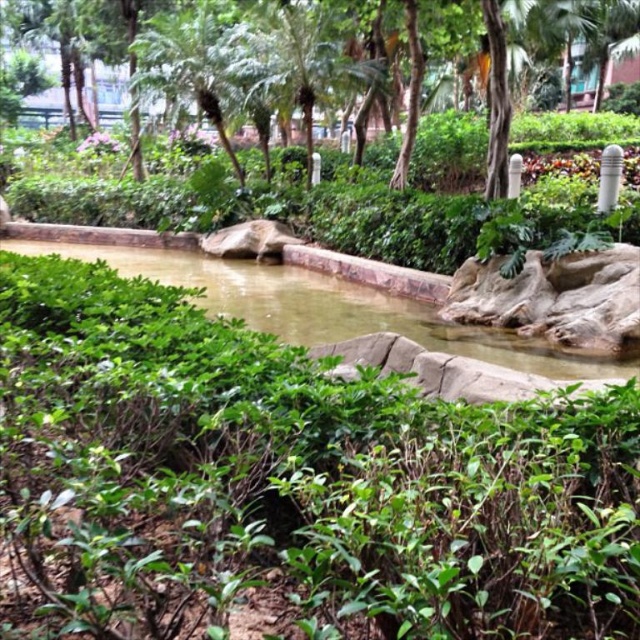
You are standing in the garden and want to take a photo of both the point at coordinates (x=627, y=42) and the point at coordinates (x=163, y=248). Which point should you focus on first to ensure both are in clear view?

You should focus on point (x=627, y=42) first because it is closer to the camera than point (x=163, y=248), ensuring both points are in focus.